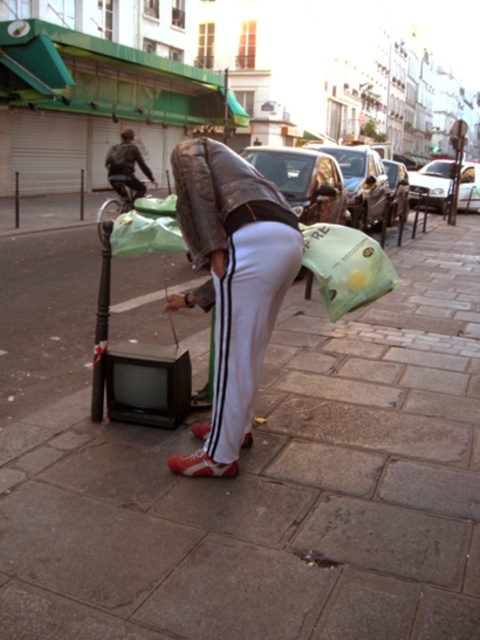
Is point (451, 538) behind point (266, 195)?

No, it is not.

The height and width of the screenshot is (640, 480). In order to click on gray concrete pavement at center in this screenshot , I will do `click(274, 486)`.